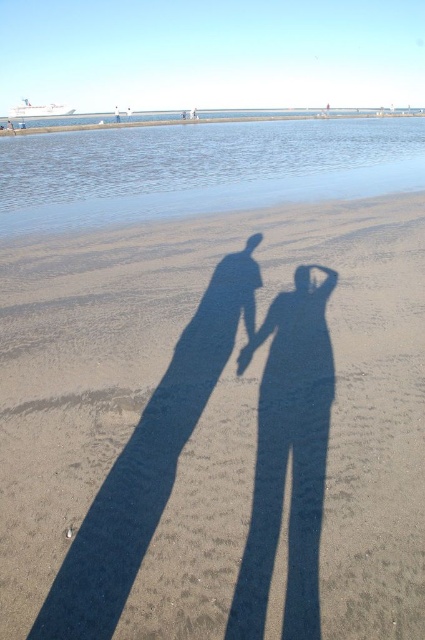
You are standing on the beach and want to place a small seashell exactly where the dark sand at center is. According to the coordinates provided, where should you place the seashell?

The dark sand at center is located at point (215, 428), so you should place the seashell at those coordinates.

You are a photographer standing at the beach scene. You want to take a photo that includes both the point at coordinates point (42, 330) and point (249, 348). Which point should you focus on first to ensure both are in focus?

You should focus on point (42, 330) first because it is closer to the camera than point (249, 348). This ensures that both points will be within the depth of field when using a suitable aperture setting.